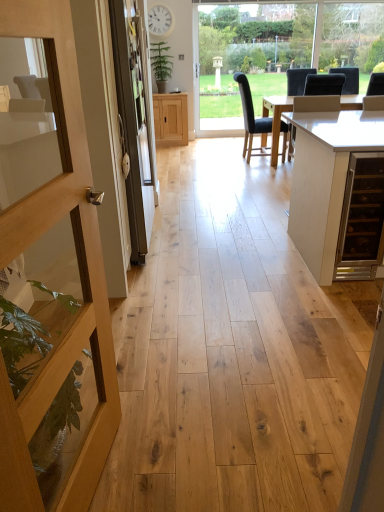
Question: Should I look upward or downward to see wooden door at left?

Choices:
 (A) down
 (B) up

Answer: (A)

Question: Can you confirm if clear glass screen door at left is thinner than dark gray fabric chair at center, placed as the second chair when sorted from left to right?

Choices:
 (A) no
 (B) yes

Answer: (B)

Question: Would you say clear glass screen door at left is outside dark gray fabric chair at center, placed as the second chair when sorted from left to right?

Choices:
 (A) yes
 (B) no

Answer: (A)

Question: Can you confirm if clear glass screen door at left is shorter than dark gray fabric chair at center, placed as the second chair when sorted from left to right?

Choices:
 (A) no
 (B) yes

Answer: (A)

Question: Does clear glass screen door at left appear on the left side of dark gray fabric chair at center, placed as the second chair when sorted from left to right?

Choices:
 (A) yes
 (B) no

Answer: (A)

Question: From the image's perspective, does clear glass screen door at left appear lower than dark gray fabric chair at center, placed as the second chair when sorted from left to right?

Choices:
 (A) no
 (B) yes

Answer: (B)

Question: Can dark gray fabric chair at center, placed as the second chair when sorted from left to right, be found inside clear glass screen door at left?

Choices:
 (A) yes
 (B) no

Answer: (B)

Question: Considering the relative sizes of transparent glass window at center and dark gray fabric chair at center, placed as the second chair when sorted from left to right, in the image provided, is transparent glass window at center smaller than dark gray fabric chair at center, placed as the second chair when sorted from left to right,?

Choices:
 (A) yes
 (B) no

Answer: (A)

Question: Are transparent glass window at center and dark gray fabric chair at center, placed as the second chair when sorted from left to right, far apart?

Choices:
 (A) no
 (B) yes

Answer: (B)

Question: Is dark gray fabric chair at center, placed as the second chair when sorted from left to right, a part of transparent glass window at center?

Choices:
 (A) yes
 (B) no

Answer: (B)

Question: Is transparent glass window at center facing away from dark gray fabric chair at center, the 1th chair in the right-to-left sequence?

Choices:
 (A) no
 (B) yes

Answer: (A)

Question: From a real-world perspective, is transparent glass window at center physically below dark gray fabric chair at center, the 1th chair in the right-to-left sequence?

Choices:
 (A) no
 (B) yes

Answer: (A)

Question: Does transparent glass window at center appear on the right side of dark gray fabric chair at center, placed as the second chair when sorted from left to right?

Choices:
 (A) yes
 (B) no

Answer: (B)

Question: Is clear glass screen door at left positioned in front of transparent glass window at center?

Choices:
 (A) yes
 (B) no

Answer: (A)